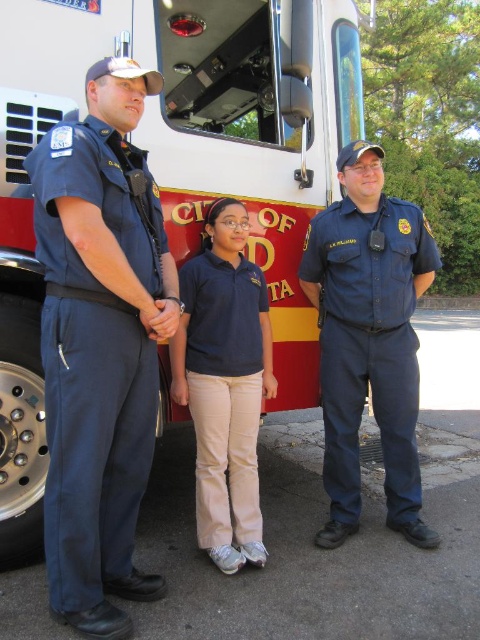
Does red and white fire truck at center have a lesser width compared to blue cotton shirt at center?

No, red and white fire truck at center is not thinner than blue cotton shirt at center.

Is point (289, 310) positioned behind point (412, 348)?

That is True.

I want to click on red and white fire truck at center, so click(173, 170).

Is red and white fire truck at center wider than navy blue uniform at left?

Indeed, red and white fire truck at center has a greater width compared to navy blue uniform at left.

Between red and white fire truck at center and navy blue uniform at left, which one appears on the left side from the viewer's perspective?

navy blue uniform at left is more to the left.

Is point (237, 163) closer to viewer compared to point (139, 392)?

That is False.

Identify the location of red and white fire truck at center. (173, 170).

Based on the photo, is red and white fire truck at center positioned before navy blue cotton shirt at center?

That is True.

Who is higher up, red and white fire truck at center or navy blue cotton shirt at center?

Positioned higher is red and white fire truck at center.

Image resolution: width=480 pixels, height=640 pixels. What are the coordinates of `red and white fire truck at center` in the screenshot? It's located at (173, 170).